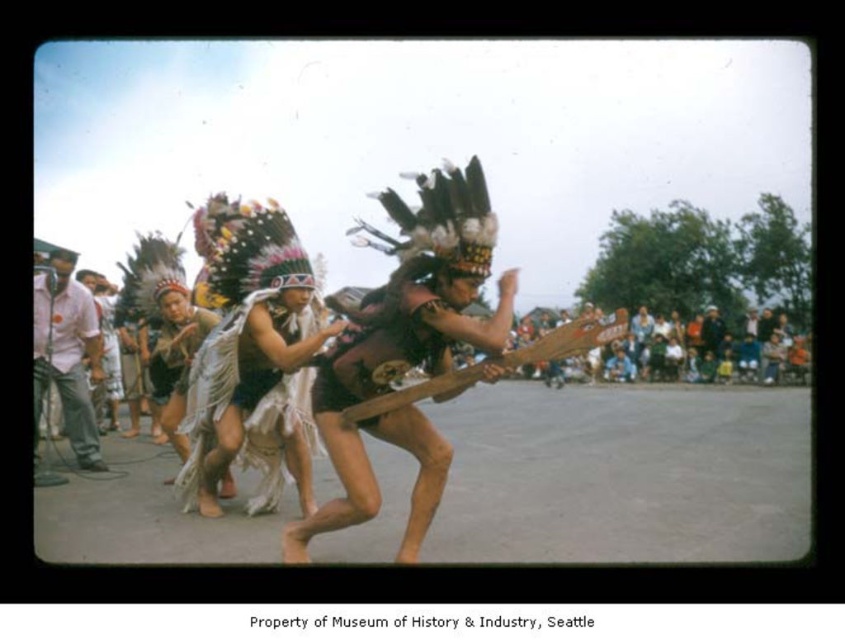
Consider the image. You are a photographer standing behind the performers. You want to take a photo that includes both the white fringed fabric at center and the white cotton shirt at left. What is the minimum distance you need to move backward to ensure both objects are in frame?

The minimum distance you need to move backward is 2.71 meters to ensure both the white fringed fabric at center and the white cotton shirt at left are in frame.

You are a photographer trying to capture the cultural performance. You notice two points in the scene at coordinates point (295, 480) and point (37, 284). Which point is nearer to your camera lens?

Point (295, 480) is closer to the camera than point (37, 284), so the photographer should focus on that point for a clearer shot.